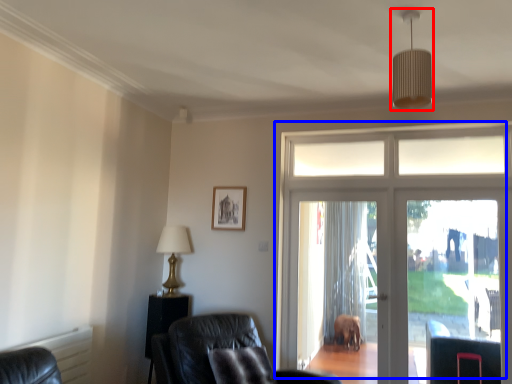
Question: Among these objects, which one is nearest to the camera, light fixture (highlighted by a red box) or door (highlighted by a blue box)?

Choices:
 (A) light fixture
 (B) door

Answer: (A)